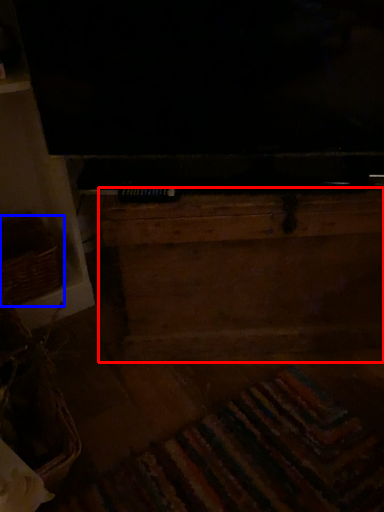
Question: Which point is closer to the camera, dresser (highlighted by a red box) or basket (highlighted by a blue box)?

Choices:
 (A) dresser
 (B) basket

Answer: (A)